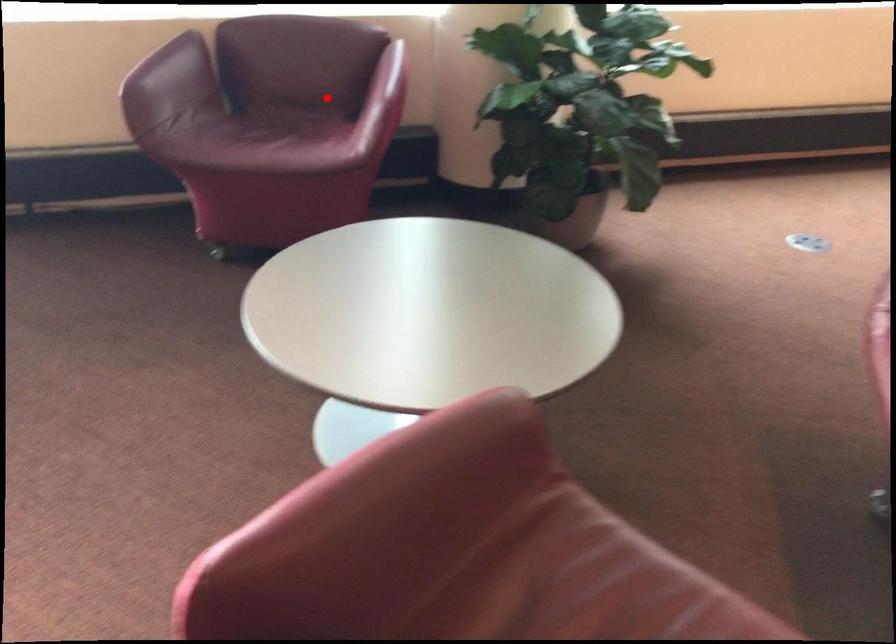
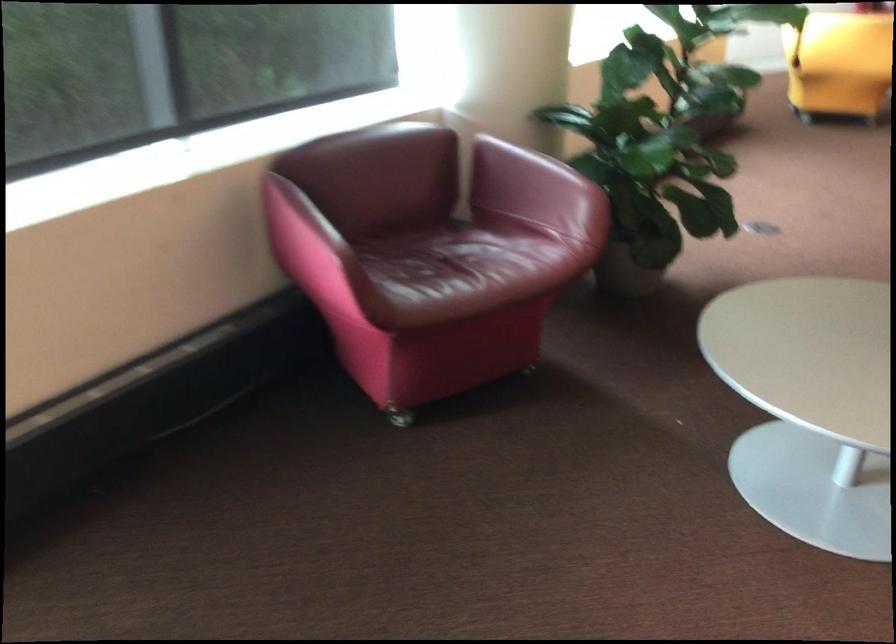
Question: I am providing you with two images of the same scene from different viewpoints. In image1, a red point is highlighted. Considering the same 3D point in image2, which of the following is correct?

Choices:
 (A) It is closer
 (B) It is farther

Answer: (A)